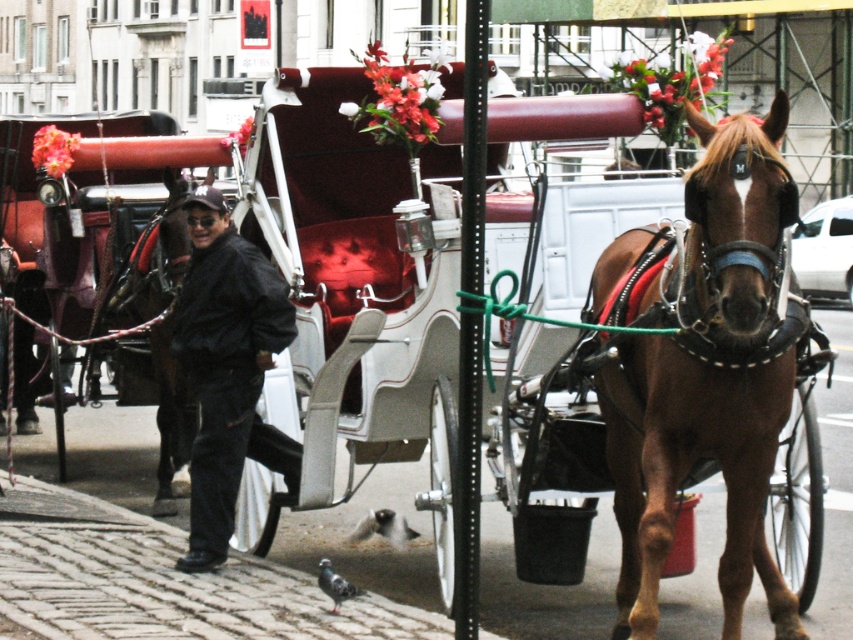
Question: Does black matte jacket at center have a larger size compared to gray speckled pigeon at lower center?

Choices:
 (A) no
 (B) yes

Answer: (B)

Question: Can you confirm if gray matte pigeon at lower center is positioned to the left of gray speckled pigeon at lower center?

Choices:
 (A) yes
 (B) no

Answer: (B)

Question: Among these objects, which one is farthest from the camera?

Choices:
 (A) black matte jacket at center
 (B) gray speckled pigeon at lower center
 (C) brown glossy horse at center

Answer: (A)

Question: Which object is positioned farthest from the brown glossy horse at center?

Choices:
 (A) black matte jacket at center
 (B) gray matte pigeon at lower center

Answer: (B)

Question: Which point appears closest to the camera in this image?

Choices:
 (A) (387, 529)
 (B) (325, 579)

Answer: (B)

Question: Does brown glossy horse at center appear on the left side of black matte jacket at center?

Choices:
 (A) no
 (B) yes

Answer: (A)